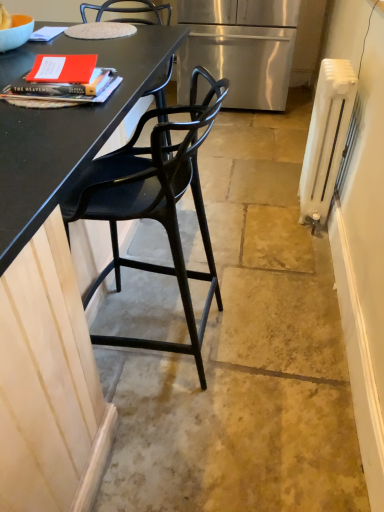
Question: Would you say white painted metal radiator at right is inside or outside stainless steel refrigerator at center?

Choices:
 (A) inside
 (B) outside

Answer: (B)

Question: Would you say white painted metal radiator at right is to the left or to the right of stainless steel refrigerator at center in the picture?

Choices:
 (A) right
 (B) left

Answer: (A)

Question: Which of these objects is positioned closest to the stainless steel refrigerator at center?

Choices:
 (A) white painted metal radiator at right
 (B) black matte chair at left

Answer: (A)

Question: Estimate the real-world distances between objects in this image. Which object is farther from the stainless steel refrigerator at center?

Choices:
 (A) white painted metal radiator at right
 (B) black matte chair at left

Answer: (B)